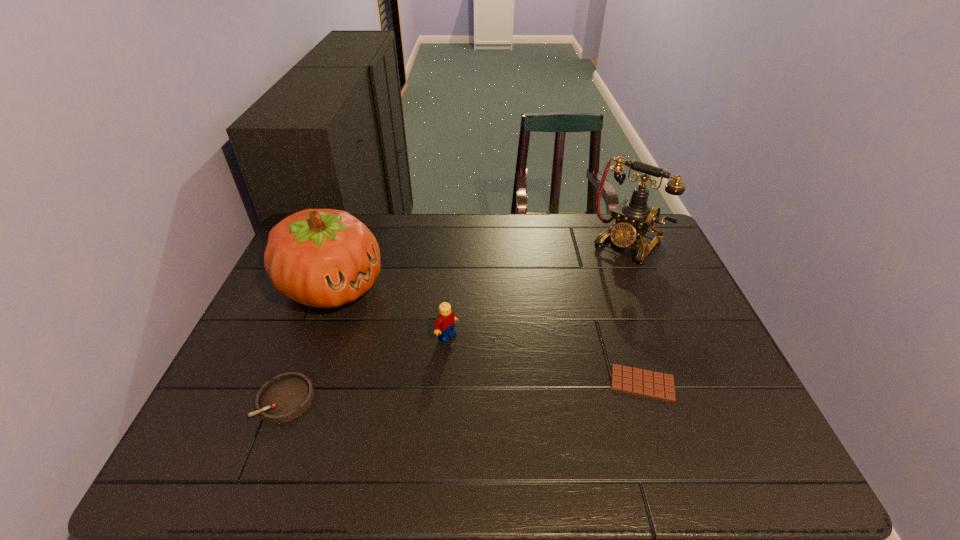
This screenshot has width=960, height=540. What are the coordinates of `vacant spot on the desktop that is between the ashtray and the candy bar and is positioned on the side of the pumpkin with the cute face` in the screenshot? It's located at (516, 389).

This screenshot has width=960, height=540. Find the location of `vacant space on the desktop that is between the second shortest object and the shortest object and is positioned on the front-facing side of the Lego`. vacant space on the desktop that is between the second shortest object and the shortest object and is positioned on the front-facing side of the Lego is located at coordinates (517, 389).

Identify the location of vacant space on the desktop that is between the ashtray and the candy bar and is positioned on the front of the telephone, featuring the rotary dial. (495, 390).